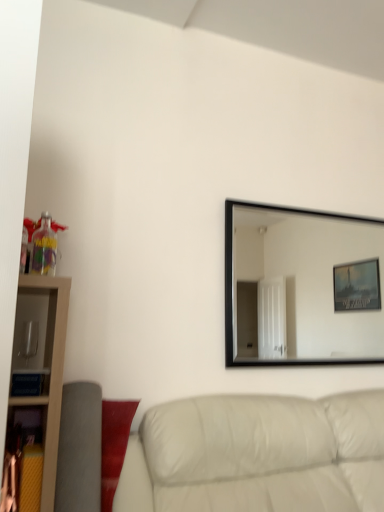
Based on the photo, measure the distance between black frame mirror at upper right and camera.

black frame mirror at upper right and camera are 3.05 meters apart from each other.

Describe the element at coordinates (302, 287) in the screenshot. I see `black frame mirror at upper right` at that location.

You are a GUI agent. You are given a task and a screenshot of the screen. Output one action in this format:
    pyautogui.click(x=<x>, y=<y>)
    Task: Click on the black frame mirror at upper right
    The width and height of the screenshot is (384, 512).
    Given the screenshot: What is the action you would take?
    pyautogui.click(x=302, y=287)

What is the approximate width of white leather couch at lower right?

white leather couch at lower right is 3.33 feet wide.

Identify the location of white leather couch at lower right. Image resolution: width=384 pixels, height=512 pixels. (257, 455).

This screenshot has height=512, width=384. Describe the element at coordinates (257, 455) in the screenshot. I see `white leather couch at lower right` at that location.

The image size is (384, 512). I want to click on black frame mirror at upper right, so click(302, 287).

Which object is positioned more to the left, black frame mirror at upper right or white leather couch at lower right?

Positioned to the left is white leather couch at lower right.

Which object is further away from the camera taking this photo, black frame mirror at upper right or white leather couch at lower right?

black frame mirror at upper right.

Between point (301, 283) and point (245, 436), which one is positioned behind?

The point (301, 283) is behind.

From the image's perspective, is black frame mirror at upper right located above white leather couch at lower right?

Correct, black frame mirror at upper right appears higher than white leather couch at lower right in the image.

From a real-world perspective, relative to white leather couch at lower right, is black frame mirror at upper right vertically above or below?

black frame mirror at upper right is situated higher than white leather couch at lower right in the real world.

Considering the sizes of black frame mirror at upper right and white leather couch at lower right in the image, is black frame mirror at upper right wider or thinner than white leather couch at lower right?

Considering their sizes, black frame mirror at upper right looks slimmer than white leather couch at lower right.

Who is shorter, black frame mirror at upper right or white leather couch at lower right?

With less height is white leather couch at lower right.

Can you confirm if black frame mirror at upper right is bigger than white leather couch at lower right?

No.

Do you think black frame mirror at upper right is within white leather couch at lower right, or outside of it?

black frame mirror at upper right is located beyond the bounds of white leather couch at lower right.

Is black frame mirror at upper right far from white leather couch at lower right?

black frame mirror at upper right is positioned a significant distance from white leather couch at lower right.

Is black frame mirror at upper right oriented away from white leather couch at lower right?

black frame mirror at upper right is not turned away from white leather couch at lower right.

Can you tell me how much black frame mirror at upper right and white leather couch at lower right differ in facing direction?

There is a 0.366-degree angle between the facing directions of black frame mirror at upper right and white leather couch at lower right.

Find the location of a particular element. The image size is (384, 512). studio couch lying below the black frame mirror at upper right (from the image's perspective) is located at coordinates (257, 455).

Which is more to the right, white leather couch at lower right or black frame mirror at upper right?

black frame mirror at upper right is more to the right.

Which object is closer to the camera taking this photo, white leather couch at lower right or black frame mirror at upper right?

white leather couch at lower right is more forward.

Which is in front, point (262, 502) or point (313, 277)?

The point (262, 502) is closer.

From the image's perspective, is white leather couch at lower right located above or below black frame mirror at upper right?

white leather couch at lower right is situated lower than black frame mirror at upper right in the image.

From a real-world perspective, does white leather couch at lower right sit lower than black frame mirror at upper right?

Correct, in the physical world, white leather couch at lower right is lower than black frame mirror at upper right.

Which object is wider, white leather couch at lower right or black frame mirror at upper right?

Wider between the two is white leather couch at lower right.

Who is taller, white leather couch at lower right or black frame mirror at upper right?

black frame mirror at upper right.

Can you confirm if white leather couch at lower right is bigger than black frame mirror at upper right?

Indeed, white leather couch at lower right has a larger size compared to black frame mirror at upper right.

Is black frame mirror at upper right surrounded by white leather couch at lower right?

No, black frame mirror at upper right is not inside white leather couch at lower right.

Is there a large distance between white leather couch at lower right and black frame mirror at upper right?

white leather couch at lower right is far away from black frame mirror at upper right.

In the scene shown: Is black frame mirror at upper right at the back of white leather couch at lower right?

white leather couch at lower right is not turned away from black frame mirror at upper right.

In the image, there is a black frame mirror at upper right. Where is `studio couch below it (from the image's perspective)`? This screenshot has width=384, height=512. studio couch below it (from the image's perspective) is located at coordinates (257, 455).

You are a GUI agent. You are given a task and a screenshot of the screen. Output one action in this format:
    pyautogui.click(x=<x>, y=<y>)
    Task: Click on the studio couch on the left of black frame mirror at upper right
    The height and width of the screenshot is (512, 384).
    Given the screenshot: What is the action you would take?
    pyautogui.click(x=257, y=455)

You are a GUI agent. You are given a task and a screenshot of the screen. Output one action in this format:
    pyautogui.click(x=<x>, y=<y>)
    Task: Click on the studio couch that is in front of the black frame mirror at upper right
    This screenshot has height=512, width=384.
    Given the screenshot: What is the action you would take?
    pyautogui.click(x=257, y=455)